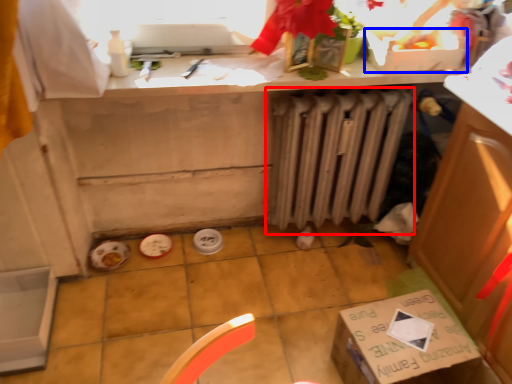
Question: Among these objects, which one is farthest to the camera, radiator (highlighted by a red box) or box (highlighted by a blue box)?

Choices:
 (A) radiator
 (B) box

Answer: (A)